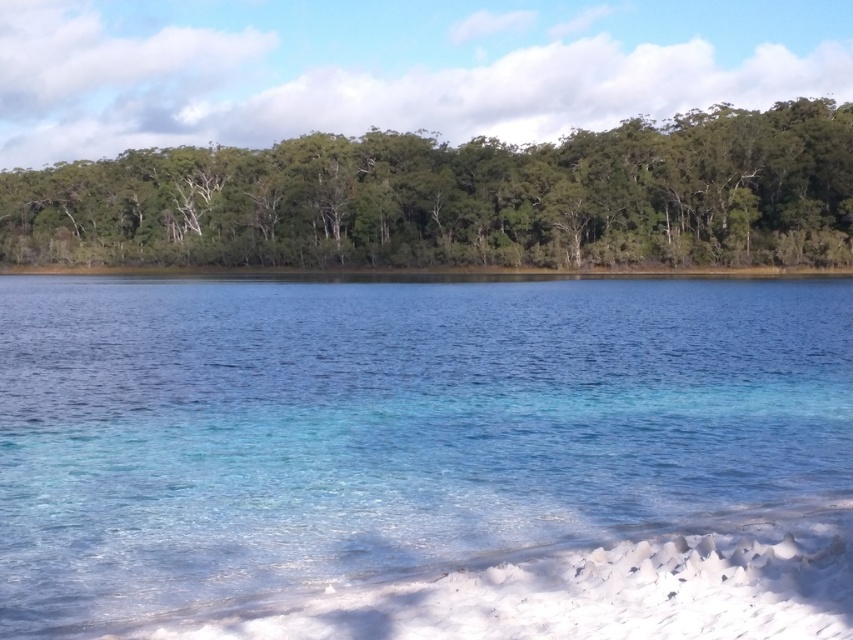
Question: Which point appears closest to the camera in this image?

Choices:
 (A) (778, 202)
 (B) (431, 576)

Answer: (B)

Question: Does clear glass water at center appear on the right side of green leafy trees at upper center?

Choices:
 (A) yes
 (B) no

Answer: (A)

Question: Among these objects, which one is farthest from the camera?

Choices:
 (A) clear glass water at center
 (B) green leafy trees at upper center

Answer: (B)

Question: Observing the image, what is the correct spatial positioning of clear glass water at center in reference to green leafy trees at upper center?

Choices:
 (A) left
 (B) right

Answer: (B)

Question: In this image, where is clear glass water at center located relative to green leafy trees at upper center?

Choices:
 (A) above
 (B) below

Answer: (B)